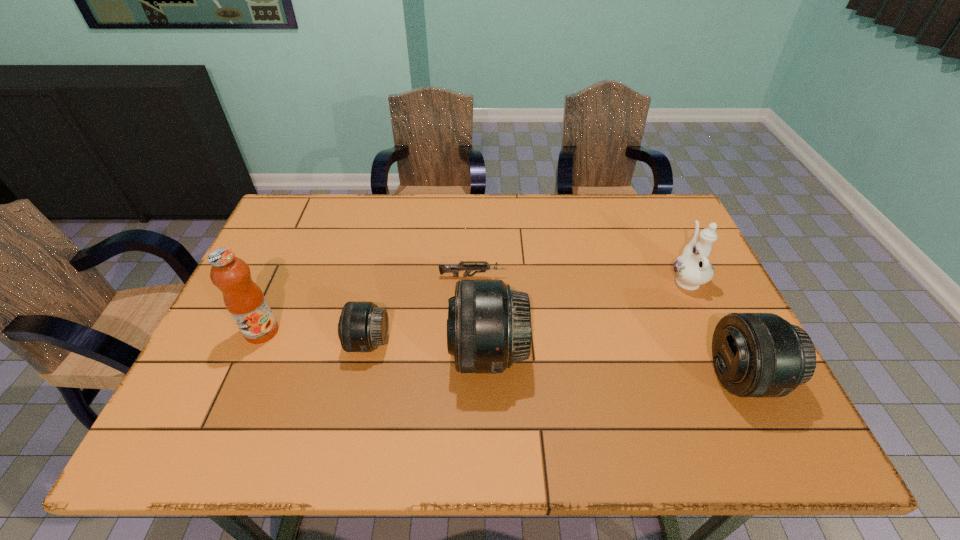
The image size is (960, 540). I want to click on free region located 0.340m at the spout of the chinaware, so click(647, 196).

What are the coordinates of `vacant point located on the front label of the fruit juice` in the screenshot? It's located at (242, 376).

Identify the location of vacant space situated 0.050m aimed along the barrel of the gun. The width and height of the screenshot is (960, 540). (523, 276).

The height and width of the screenshot is (540, 960). I want to click on object that is positioned at the left edge, so click(243, 298).

Image resolution: width=960 pixels, height=540 pixels. In order to click on telephoto lens that is at the right edge in this screenshot , I will do `click(755, 354)`.

Locate an element on the screen. chinaware at the right edge is located at coordinates (692, 269).

Locate an element on the screen. object at the near right corner is located at coordinates (755, 354).

The width and height of the screenshot is (960, 540). What are the coordinates of `vacant space at the far edge of the desktop` in the screenshot? It's located at (497, 204).

Identify the location of vacant area at the near edge. The image size is (960, 540). (369, 403).

Locate an element on the screen. The height and width of the screenshot is (540, 960). vacant space at the left edge is located at coordinates (281, 338).